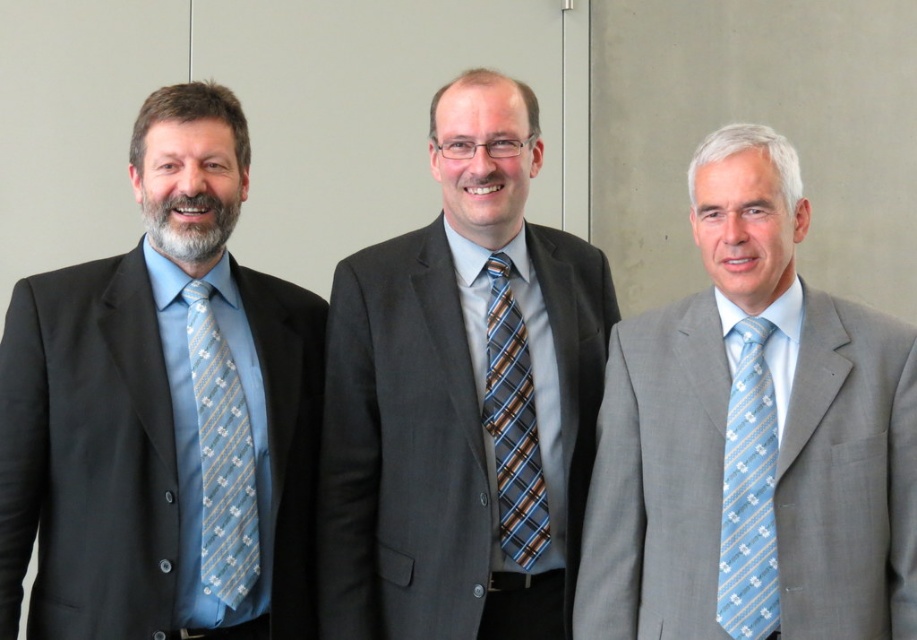
Question: Does light gray suit at right appear under brown plaid tie at center?

Choices:
 (A) no
 (B) yes

Answer: (A)

Question: Which of the following is the farthest from the observer?

Choices:
 (A) (736, 564)
 (B) (650, 454)
 (C) (206, 433)
 (D) (503, 522)

Answer: (D)

Question: In this image, where is light gray suit at right located relative to light blue silk tie at right?

Choices:
 (A) above
 (B) below

Answer: (A)

Question: Which point is farther to the camera?

Choices:
 (A) (736, 588)
 (B) (225, 502)

Answer: (B)

Question: Does light blue silk tie at right appear on the left side of light blue silk tie at left?

Choices:
 (A) yes
 (B) no

Answer: (B)

Question: Which object is the farthest from the matte black suit at left?

Choices:
 (A) light blue silk tie at right
 (B) brown plaid tie at center
 (C) matte gray suit at center

Answer: (A)